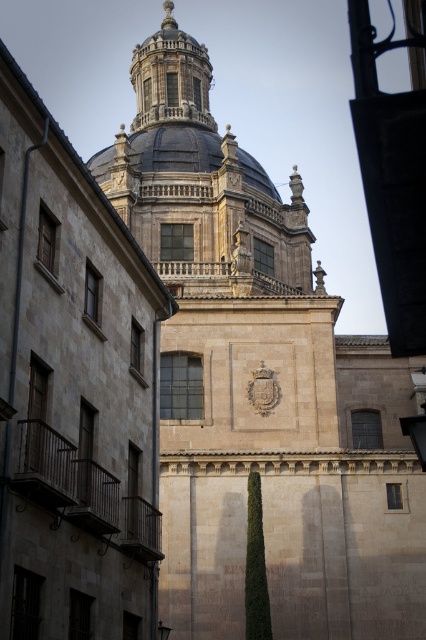
The height and width of the screenshot is (640, 426). I want to click on blue stone dome at center, so click(172, 102).

Between blue stone dome at center and smooth gray dome at center, which one is positioned lower?

smooth gray dome at center is lower down.

Which is behind, point (161, 138) or point (140, 150)?

The point (161, 138) is behind.

You are a GUI agent. You are given a task and a screenshot of the screen. Output one action in this format:
    pyautogui.click(x=<x>, y=<y>)
    Task: Click on the blue stone dome at center
    The image size is (426, 640).
    Given the screenshot: What is the action you would take?
    pyautogui.click(x=172, y=102)